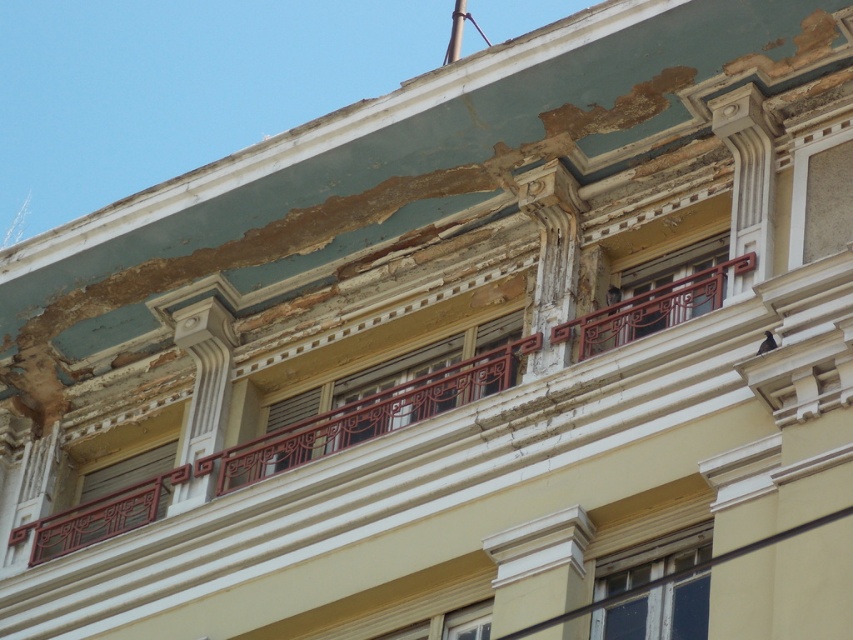
Can you confirm if wooden lattice window at center is positioned to the right of matte red railing at lower left?

Correct, you'll find wooden lattice window at center to the right of matte red railing at lower left.

Is wooden lattice window at center closer to camera compared to matte red railing at lower left?

Yes, it is.

Between point (628, 298) and point (160, 468), which one is positioned in front?

Point (628, 298) is more forward.

Image resolution: width=853 pixels, height=640 pixels. Find the location of `wooden lattice window at center`. wooden lattice window at center is located at coordinates (672, 289).

Does matte red railing at lower left have a smaller size compared to matte wood window at center?

No.

Between matte red railing at lower left and matte wood window at center, which one is positioned higher?

matte wood window at center

Which is in front, point (97, 481) or point (299, 396)?

Point (299, 396) is more forward.

This screenshot has width=853, height=640. Find the location of `matte red railing at lower left`. matte red railing at lower left is located at coordinates (126, 472).

Consider the image. Who is positioned more to the left, wooden frame window at center or wooden lattice window at center?

wooden frame window at center is more to the left.

Is point (643, 611) more distant than point (636, 307)?

No.

Is point (643, 634) farther from viewer compared to point (636, 332)?

No, it is in front of (636, 332).

This screenshot has height=640, width=853. Identify the location of wooden frame window at center. (659, 612).